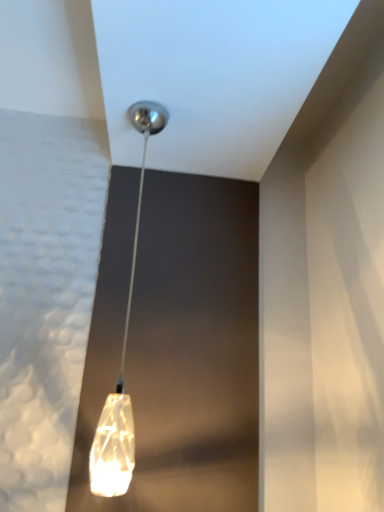
At what (x,y) coordinates should I click in order to perform the action: click on translucent glass pendant light at center. Please return your answer as a coordinate pair (x, y). Image resolution: width=384 pixels, height=512 pixels. Looking at the image, I should click on (123, 357).

The height and width of the screenshot is (512, 384). What do you see at coordinates (123, 357) in the screenshot? I see `translucent glass pendant light at center` at bounding box center [123, 357].

At what (x,y) coordinates should I click in order to perform the action: click on translucent glass pendant light at center. Please return your answer as a coordinate pair (x, y). The image size is (384, 512). Looking at the image, I should click on (123, 357).